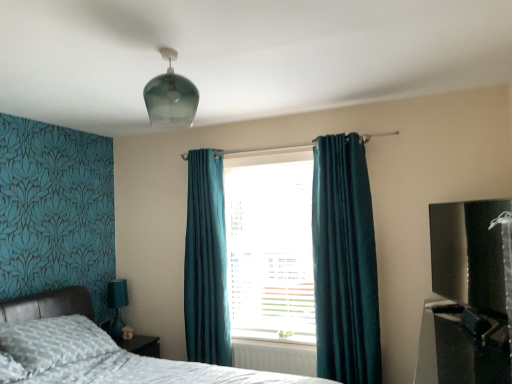
Question: Is black glossy tv at right, which is the first entertainment center from top to bottom, touching patterned fabric bed at lower left?

Choices:
 (A) yes
 (B) no

Answer: (B)

Question: Considering the relative sizes of black glossy tv at right, marked as the 2th entertainment center in a bottom-to-top arrangement, and patterned fabric bed at lower left in the image provided, is black glossy tv at right, marked as the 2th entertainment center in a bottom-to-top arrangement, shorter than patterned fabric bed at lower left?

Choices:
 (A) yes
 (B) no

Answer: (A)

Question: From a real-world perspective, does black glossy tv at right, which is the first entertainment center from top to bottom, sit lower than patterned fabric bed at lower left?

Choices:
 (A) no
 (B) yes

Answer: (A)

Question: Could you tell me if black glossy tv at right, marked as the 2th entertainment center in a bottom-to-top arrangement, is turned towards patterned fabric bed at lower left?

Choices:
 (A) no
 (B) yes

Answer: (B)

Question: From the image's perspective, does black glossy tv at right, which is the first entertainment center from top to bottom, appear lower than patterned fabric bed at lower left?

Choices:
 (A) no
 (B) yes

Answer: (A)

Question: From a real-world perspective, is patterned fabric bed at lower left above or below black glossy tv at right, which is the first entertainment center from top to bottom?

Choices:
 (A) below
 (B) above

Answer: (A)

Question: Is patterned fabric bed at lower left to the left or to the right of black glossy tv at right, which is the first entertainment center from top to bottom, in the image?

Choices:
 (A) right
 (B) left

Answer: (B)

Question: Is patterned fabric bed at lower left in front of or behind black glossy tv at right, which is the first entertainment center from top to bottom, in the image?

Choices:
 (A) behind
 (B) front

Answer: (B)

Question: Considering the positions of patterned fabric bed at lower left and black glossy tv at right, which is the first entertainment center from top to bottom, in the image, is patterned fabric bed at lower left taller or shorter than black glossy tv at right, which is the first entertainment center from top to bottom,?

Choices:
 (A) short
 (B) tall

Answer: (B)

Question: Looking at their shapes, would you say teal fabric lampshade at lower left is wider or thinner than teal velvet curtain at center, the second curtain positioned from the back?

Choices:
 (A) wide
 (B) thin

Answer: (B)

Question: Considering the positions of teal fabric lampshade at lower left and teal velvet curtain at center, the 1th curtain positioned from the right, in the image, is teal fabric lampshade at lower left bigger or smaller than teal velvet curtain at center, the 1th curtain positioned from the right,?

Choices:
 (A) small
 (B) big

Answer: (A)

Question: From a real-world perspective, is teal fabric lampshade at lower left positioned above or below teal velvet curtain at center, the second curtain positioned from the back?

Choices:
 (A) above
 (B) below

Answer: (B)

Question: In terms of height, does teal fabric lampshade at lower left look taller or shorter compared to teal velvet curtain at center, placed as the second curtain when sorted from left to right?

Choices:
 (A) tall
 (B) short

Answer: (B)

Question: Is black plastic entertainment center at lower right, which is counted as the 1th entertainment center, starting from the bottom, to the left or to the right of teal fabric lampshade at lower left in the image?

Choices:
 (A) left
 (B) right

Answer: (B)

Question: In the image, is black plastic entertainment center at lower right, which is counted as the 1th entertainment center, starting from the bottom, positioned in front of or behind teal fabric lampshade at lower left?

Choices:
 (A) behind
 (B) front

Answer: (B)